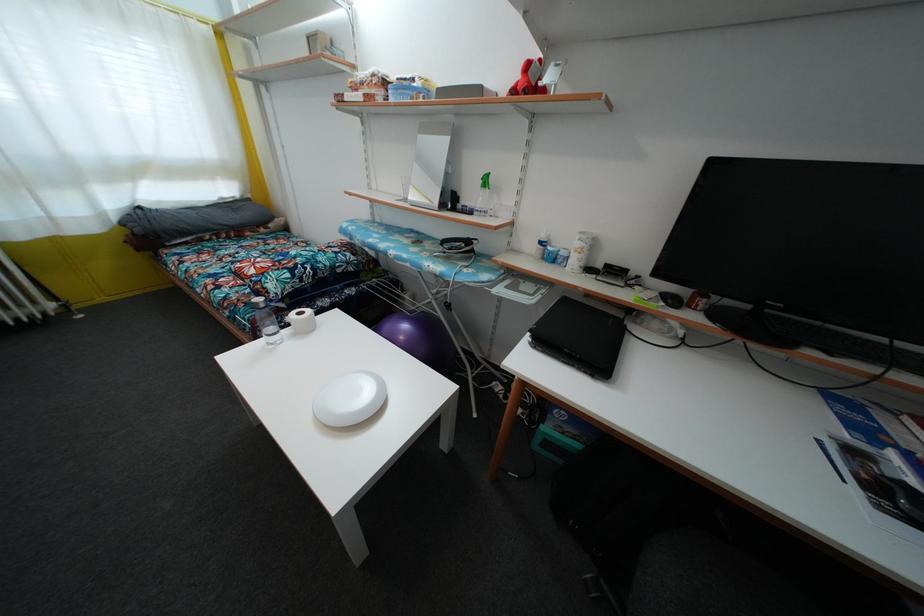
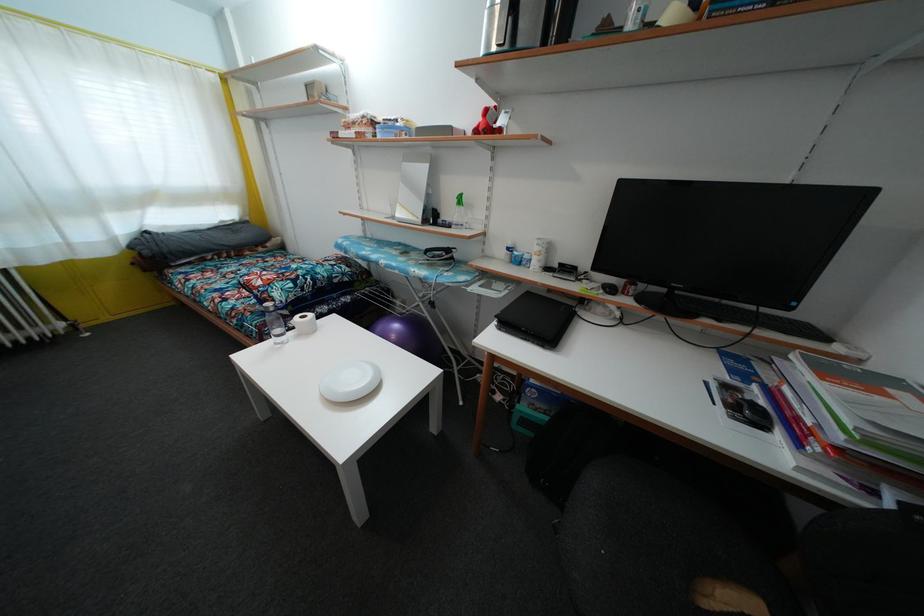
Find the pixel in the second image that matches point 265,312 in the first image.

(275, 315)